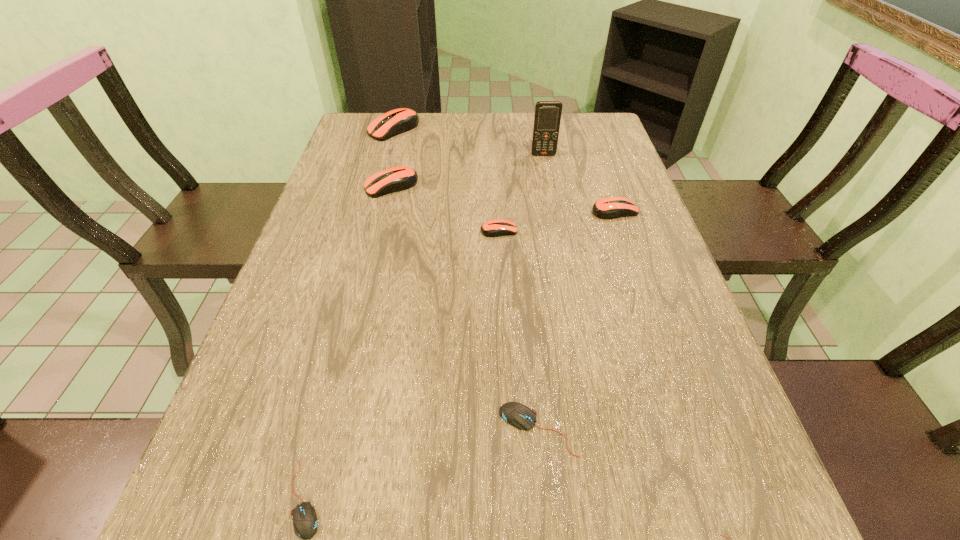
Image resolution: width=960 pixels, height=540 pixels. I want to click on object at the far left corner, so click(x=397, y=121).

In the image, there is a desktop. At what (x,y) coordinates should I click in order to perform the action: click on vacant space at the left edge. Please return your answer as a coordinate pair (x, y). The image size is (960, 540). Looking at the image, I should click on (355, 151).

Image resolution: width=960 pixels, height=540 pixels. In the image, there is a desktop. In order to click on free region at the right edge in this screenshot , I will do `click(706, 433)`.

Locate an element on the screen. vacant space at the far right corner is located at coordinates (613, 132).

This screenshot has width=960, height=540. I want to click on unoccupied position between the seventh shortest object and the sixth shortest mouse, so click(393, 158).

Identify the location of free point between the fourth shortest mouse and the fifth tallest mouse. This screenshot has height=540, width=960. (518, 330).

Identify the location of vacant space that is in between the second nearest orange computer mouse and the third nearest orange computer mouse. (503, 199).

Image resolution: width=960 pixels, height=540 pixels. What are the coordinates of `vacant region between the sixth shortest object and the fourth tallest mouse` in the screenshot? It's located at (445, 208).

The width and height of the screenshot is (960, 540). I want to click on free space between the fifth farthest object and the cellular telephone, so click(x=521, y=193).

What are the coordinates of `vacant area that lies between the farthest black mouse and the farthest orange computer mouse` in the screenshot? It's located at (466, 279).